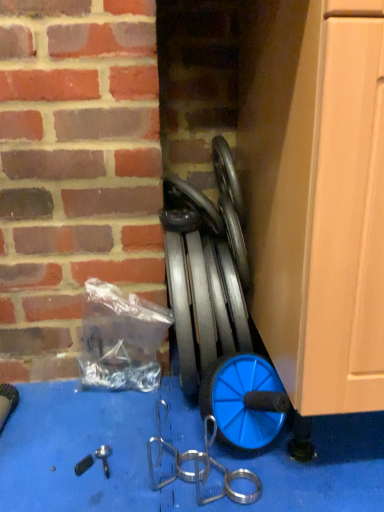
The width and height of the screenshot is (384, 512). What do you see at coordinates (218, 309) in the screenshot?
I see `blue rubber hose at center` at bounding box center [218, 309].

Measure the distance between point (231,442) and camera.

78.60 centimeters.

This screenshot has width=384, height=512. I want to click on blue rubber wheel at center, so click(x=196, y=201).

What do you see at coordinates (121, 338) in the screenshot? I see `transparent plastic bag at center-left` at bounding box center [121, 338].

Locate an element on the screen. This screenshot has width=384, height=512. blue rubber hose at center is located at coordinates (218, 309).

Which point is more forward, (x=173, y=185) or (x=269, y=382)?

The point (x=269, y=382) is closer.

Which of these two, blue rubber wheel at center or blue rubber hose at center, is bigger?

With larger size is blue rubber hose at center.

From the image's perspective, is blue rubber wheel at center positioned above or below blue rubber hose at center?

blue rubber wheel at center is situated higher than blue rubber hose at center in the image.

Would you consider blue rubber wheel at center to be distant from blue rubber hose at center?

That's not correct — blue rubber wheel at center is a little close to blue rubber hose at center.

Is transparent plastic bag at center-left completely or partially inside blue rubber hose at center?

No, transparent plastic bag at center-left is located outside of blue rubber hose at center.

Looking at the image, does blue rubber hose at center seem bigger or smaller compared to transparent plastic bag at center-left?

In the image, blue rubber hose at center appears to be larger than transparent plastic bag at center-left.

Considering the relative sizes of blue rubber hose at center and transparent plastic bag at center-left in the image provided, is blue rubber hose at center wider than transparent plastic bag at center-left?

Yes, blue rubber hose at center is wider than transparent plastic bag at center-left.

Does blue rubber hose at center touch transparent plastic bag at center-left?

No, blue rubber hose at center is not in contact with transparent plastic bag at center-left.

Could you tell me if blue rubber hose at center is turned towards blue rubber wheel at center?

No, blue rubber hose at center does not turn towards blue rubber wheel at center.

Looking at their sizes, would you say blue rubber hose at center is wider or thinner than blue rubber wheel at center?

Considering their sizes, blue rubber hose at center looks broader than blue rubber wheel at center.

Are blue rubber hose at center and blue rubber wheel at center beside each other?

blue rubber hose at center is not next to blue rubber wheel at center, and they're not touching.

In order to click on wheel lying behind the blue rubber hose at center in this screenshot , I will do `click(196, 201)`.

Choose the correct answer: Is blue rubber wheel at center inside transparent plastic bag at center-left or outside it?

The correct answer is: outside.

Looking at the image, does blue rubber wheel at center seem bigger or smaller compared to transparent plastic bag at center-left?

blue rubber wheel at center is smaller than transparent plastic bag at center-left.

Is blue rubber wheel at center looking in the opposite direction of transparent plastic bag at center-left?

No, blue rubber wheel at center's orientation is not away from transparent plastic bag at center-left.

From a real-world perspective, is blue rubber wheel at center physically below transparent plastic bag at center-left?

No, from a real-world perspective, blue rubber wheel at center is not below transparent plastic bag at center-left.

Identify the location of garbage beneath the blue rubber hose at center (from a real-world perspective). pos(121,338).

Is transparent plastic bag at center-left surrounding blue rubber hose at center?

Definitely not — blue rubber hose at center is not inside transparent plastic bag at center-left.

Can you tell me how much transparent plastic bag at center-left and blue rubber hose at center differ in facing direction?

The facing directions of transparent plastic bag at center-left and blue rubber hose at center are 0.872 degrees apart.

In terms of width, does transparent plastic bag at center-left look wider or thinner when compared to blue rubber hose at center?

transparent plastic bag at center-left is thinner than blue rubber hose at center.

Based on their sizes in the image, would you say transparent plastic bag at center-left is bigger or smaller than blue rubber wheel at center?

Considering their sizes, transparent plastic bag at center-left takes up more space than blue rubber wheel at center.

Is transparent plastic bag at center-left beside blue rubber wheel at center?

No, transparent plastic bag at center-left is not making contact with blue rubber wheel at center.

Which is behind, transparent plastic bag at center-left or blue rubber wheel at center?

transparent plastic bag at center-left is further from the camera.

From a real-world perspective, between transparent plastic bag at center-left and blue rubber wheel at center, who is vertically lower?

transparent plastic bag at center-left, from a real-world perspective.

At what (x,y) coordinates should I click in order to perform the action: click on wheel above the blue rubber hose at center (from a real-world perspective). Please return your answer as a coordinate pair (x, y). The width and height of the screenshot is (384, 512). Looking at the image, I should click on point(196,201).

Locate an element on the screen. garbage below the blue rubber hose at center (from the image's perspective) is located at coordinates (121, 338).

When comparing their distances from transparent plastic bag at center-left, does blue rubber hose at center or blue rubber wheel at center seem further?

The object further to transparent plastic bag at center-left is blue rubber wheel at center.

Based on their spatial positions, is blue rubber hose at center or transparent plastic bag at center-left further from blue rubber wheel at center?

transparent plastic bag at center-left is positioned further to the anchor blue rubber wheel at center.

Considering their positions, is transparent plastic bag at center-left positioned closer to blue rubber hose at center than blue rubber wheel at center?

The object closer to blue rubber hose at center is blue rubber wheel at center.

Based on their spatial positions, is blue rubber wheel at center or transparent plastic bag at center-left closer to blue rubber hose at center?

blue rubber wheel at center lies closer to blue rubber hose at center than the other object.

Looking at the image, which one is located further to transparent plastic bag at center-left, blue rubber wheel at center or blue rubber hose at center?

blue rubber wheel at center.

In the scene shown: Which object lies further to the anchor point blue rubber wheel at center, transparent plastic bag at center-left or blue rubber hose at center?

transparent plastic bag at center-left is positioned further to the anchor blue rubber wheel at center.

Identify the location of garden hose between blue rubber wheel at center and transparent plastic bag at center-left in the up-down direction. This screenshot has width=384, height=512. (218, 309).